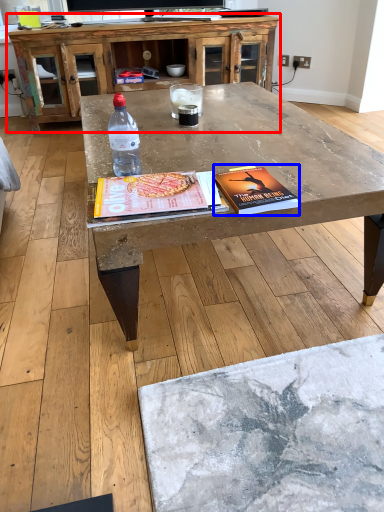
Question: Among these objects, which one is nearest to the camera, cabinetry (highlighted by a red box) or paperback book (highlighted by a blue box)?

Choices:
 (A) cabinetry
 (B) paperback book

Answer: (B)